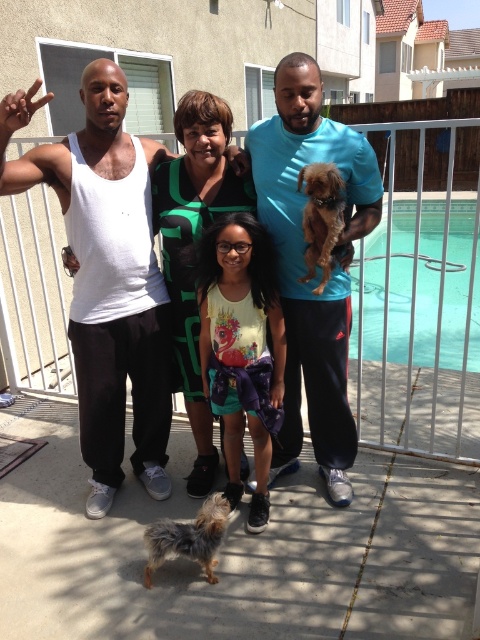
Question: Is the position of blue cotton shirt at center more distant than that of fluffy brown dog at lower left?

Choices:
 (A) yes
 (B) no

Answer: (A)

Question: Which of the following is the farthest from the observer?

Choices:
 (A) (477, 301)
 (B) (144, 449)
 (C) (340, 452)
 (D) (328, 211)

Answer: (A)

Question: Is clear glass pool at right wider than shaggy brown dog at lower center?

Choices:
 (A) no
 (B) yes

Answer: (B)

Question: Is yellow printed tank top at center behind clear glass pool at right?

Choices:
 (A) no
 (B) yes

Answer: (A)

Question: Which object is closer to the camera taking this photo?

Choices:
 (A) clear glass pool at right
 (B) fluffy brown dog at lower left
 (C) brown furry dog at center
 (D) shaggy brown dog at lower center

Answer: (B)

Question: Among these points, which one is farthest from the camera?

Choices:
 (A) (471, 364)
 (B) (202, 513)
 (C) (285, 451)
 (D) (238, 364)

Answer: (A)